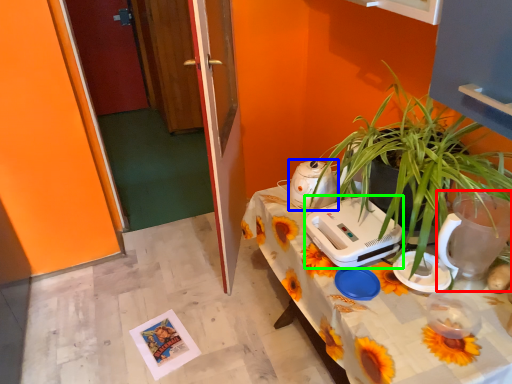
Question: Which object is positioned farthest from appliance (highlighted by a red box)? Select from appliance (highlighted by a blue box) and appliance (highlighted by a green box).

Choices:
 (A) appliance
 (B) appliance

Answer: (A)